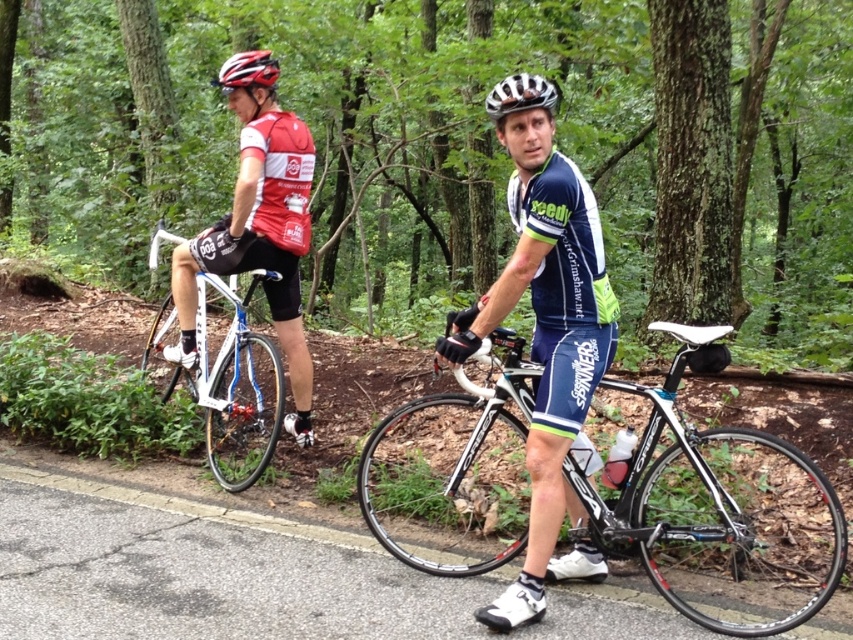
You are a photographer trying to capture a photo of the shiny black frame at center and the matte red cycling jersey at left. Based on their positions, which object should you focus on first if you want to ensure both are in the same frame without moving the camera?

The shiny black frame at center is located below the matte red cycling jersey at left, so you should focus on the matte red cycling jersey at left first to ensure both are within the camera frame.

You are a photographer trying to capture a photo of the white metallic bicycle at left and the shiny multicolored helmet at upper center. Which object should you focus on first if you want to ensure both are in the frame without moving the camera?

The white metallic bicycle at left is much taller than the shiny multicolored helmet at upper center, so you should focus on the white metallic bicycle at left first to ensure it fits within the frame.